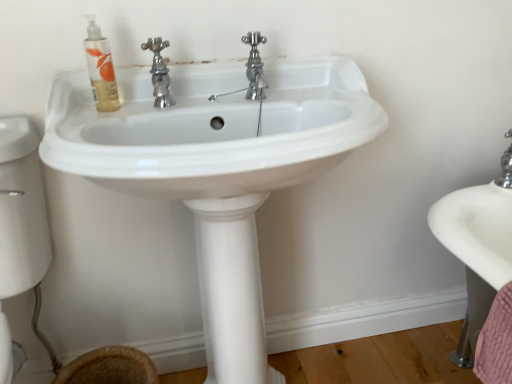
What is the approximate width of white glossy sink at center?

white glossy sink at center is 19.40 inches wide.

Measure the distance between translucent gel mouthwash at upper left and camera.

translucent gel mouthwash at upper left is 34.72 inches from camera.

Locate an element on the screen. This screenshot has height=384, width=512. brown woven basket at lower left is located at coordinates (109, 367).

Does point (139, 155) lie behind point (108, 82)?

No, it is in front of (108, 82).

Is white glossy sink at center oriented away from translucent gel mouthwash at upper left?

No.

Considering the sizes of objects white glossy sink at center and translucent gel mouthwash at upper left in the image provided, who is smaller, white glossy sink at center or translucent gel mouthwash at upper left?

translucent gel mouthwash at upper left.

Is brown woven basket at lower left positioned in front of white glossy sink at center?

No, it is not.

Is brown woven basket at lower left facing towards white glossy sink at center?

Yes, brown woven basket at lower left is oriented towards white glossy sink at center.

From the image's perspective, does brown woven basket at lower left appear lower than white glossy sink at center?

Yes, from the image's perspective, brown woven basket at lower left is beneath white glossy sink at center.

From a real-world perspective, between brown woven basket at lower left and white glossy sink at center, who is vertically higher?

white glossy sink at center is physically above.

Does point (99, 354) lie in front of point (112, 67)?

No, it is not.

Considering the sizes of brown woven basket at lower left and translucent gel mouthwash at upper left in the image, is brown woven basket at lower left wider or thinner than translucent gel mouthwash at upper left?

Clearly, brown woven basket at lower left has more width compared to translucent gel mouthwash at upper left.

Is brown woven basket at lower left facing away from translucent gel mouthwash at upper left?

No, translucent gel mouthwash at upper left is not at the back of brown woven basket at lower left.

Based on the photo, does brown woven basket at lower left lie behind translucent gel mouthwash at upper left?

Yes, it is behind translucent gel mouthwash at upper left.

Is point (109, 78) farther from viewer compared to point (118, 116)?

That is False.

Who is smaller, translucent gel mouthwash at upper left or white glossy sink at center?

translucent gel mouthwash at upper left is smaller.

Could you tell me if translucent gel mouthwash at upper left is facing white glossy sink at center?

No.

From a real-world perspective, is translucent gel mouthwash at upper left on white glossy sink at center?

Yes, from a real-world perspective, translucent gel mouthwash at upper left is on top of white glossy sink at center.

Where is `sink above the brown woven basket at lower left (from a real-world perspective)`? sink above the brown woven basket at lower left (from a real-world perspective) is located at coordinates (217, 165).

How different are the orientations of white glossy sink at center and brown woven basket at lower left in degrees?

The facing directions of white glossy sink at center and brown woven basket at lower left are 3.57 degrees apart.

Is white glossy sink at center positioned beyond the bounds of brown woven basket at lower left?

white glossy sink at center lies outside brown woven basket at lower left's area.

Is point (101, 178) farther from camera compared to point (92, 376)?

No.

Is translucent gel mouthwash at upper left to the left of brown woven basket at lower left from the viewer's perspective?

In fact, translucent gel mouthwash at upper left is to the right of brown woven basket at lower left.

From a real-world perspective, which object rests below the other?

From a 3D spatial view, brown woven basket at lower left is below.

Where is `mouthwash that is above the brown woven basket at lower left (from the image's perspective)`? This screenshot has height=384, width=512. mouthwash that is above the brown woven basket at lower left (from the image's perspective) is located at coordinates (101, 68).

Can you confirm if translucent gel mouthwash at upper left is bigger than brown woven basket at lower left?

Incorrect, translucent gel mouthwash at upper left is not larger than brown woven basket at lower left.

Image resolution: width=512 pixels, height=384 pixels. Find the location of `mouthwash above the white glossy sink at center (from the image's perspective)`. mouthwash above the white glossy sink at center (from the image's perspective) is located at coordinates (101, 68).

The image size is (512, 384). I want to click on toilet bowl located behind the white glossy sink at center, so click(x=109, y=367).

Looking at the image, which one is located further to translucent gel mouthwash at upper left, white glossy sink at center or brown woven basket at lower left?

brown woven basket at lower left is positioned further to the anchor translucent gel mouthwash at upper left.

Considering their positions, is translucent gel mouthwash at upper left positioned further to white glossy sink at center than brown woven basket at lower left?

Based on the image, brown woven basket at lower left appears to be further to white glossy sink at center.

Based on their spatial positions, is white glossy sink at center or translucent gel mouthwash at upper left closer to brown woven basket at lower left?

white glossy sink at center is positioned closer to the anchor brown woven basket at lower left.

Which object lies nearer to the anchor point brown woven basket at lower left, translucent gel mouthwash at upper left or white glossy sink at center?

Based on the image, white glossy sink at center appears to be nearer to brown woven basket at lower left.

From the image, which object appears to be nearer to white glossy sink at center, brown woven basket at lower left or translucent gel mouthwash at upper left?

translucent gel mouthwash at upper left is closer to white glossy sink at center.

When comparing their distances from translucent gel mouthwash at upper left, does brown woven basket at lower left or white glossy sink at center seem closer?

Among the two, white glossy sink at center is located nearer to translucent gel mouthwash at upper left.

I want to click on sink between translucent gel mouthwash at upper left and brown woven basket at lower left in the up-down direction, so pos(217,165).